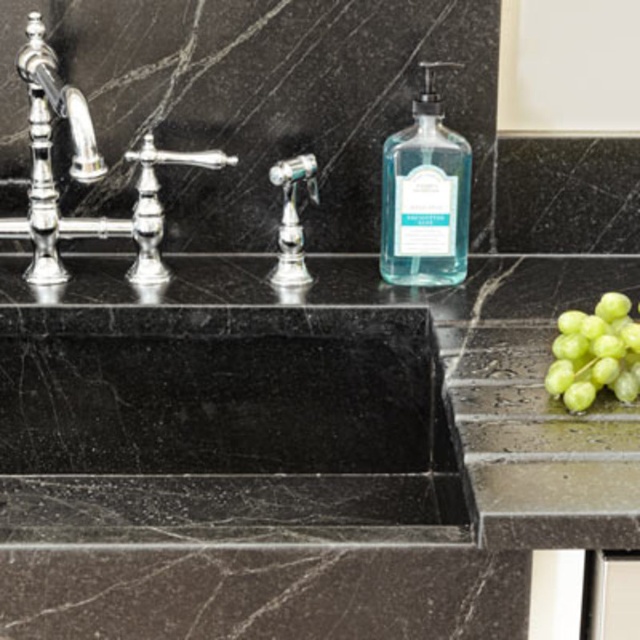
You are trying to clean the bathroom sink area. You need to reach the polished silver faucet at center to adjust the water temperature. However, there is a transparent glass soap dispenser at center in the way. Can you move the dispenser to access the faucet?

The transparent glass soap dispenser at center is positioned over the polished silver faucet at center, so you can move the dispenser to access the faucet.

Consider the image. You are organizing items on the bathroom counter and need to place the green matte grapes at right and the transparent glass soap dispenser at center. According to the current arrangement, which item is closer to you?

The transparent glass soap dispenser at center is closer to you because the green matte grapes at right is behind it.

You are trying to determine which item is taller between the transparent glass soap dispenser at center and the polished chrome faucet at center in the bathroom. Based on the scene description, which one is taller?

The transparent glass soap dispenser at center is taller than the polished chrome faucet at center according to the description.